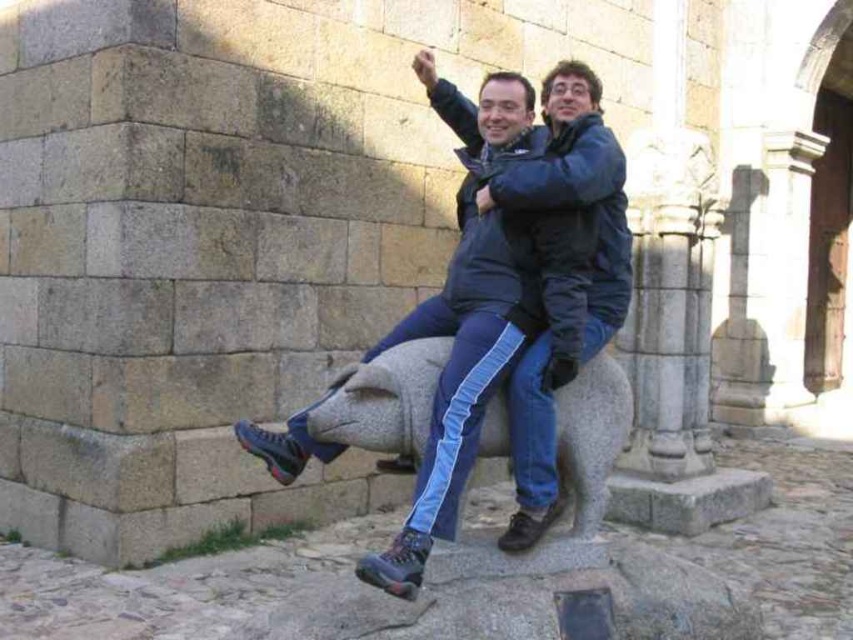
You are a photographer trying to capture a group photo of the matte black jacket at center and the gray stone pig at center. Since you want everyone to be visible, which object should you position closer to the camera to ensure it doesn

The matte black jacket at center is much taller than the gray stone pig at center, so positioning the matte black jacket at center closer to the camera will help ensure both are visible in the photo.

You are a photographer trying to capture a group photo of the matte black jacket at center and the gray stone pig at center. If your camera has a depth of field that can focus on objects within 60 centimeters of each other, will both subjects be in focus?

The distance between the matte black jacket at center and the gray stone pig at center is 60.24 centimeters. Since the camera can focus on objects within 60 centimeters, the distance slightly exceeds the limit, so both subjects may not be in focus simultaneously.